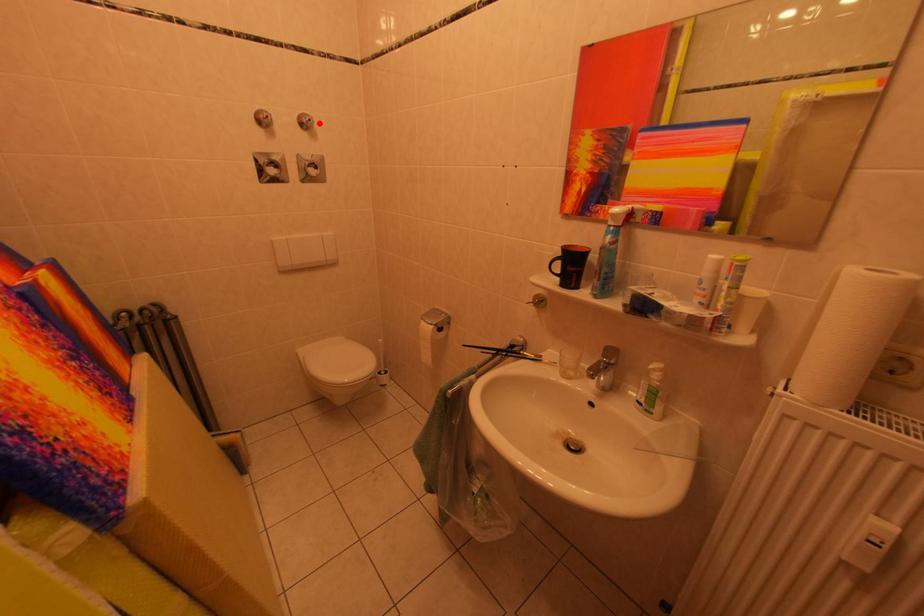
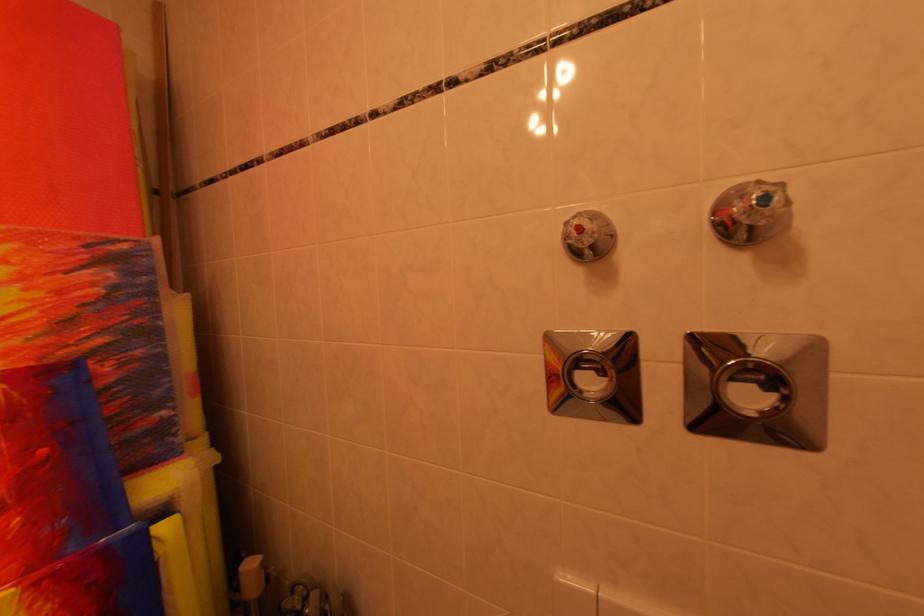
Question: I am providing you with two images of the same scene from different viewpoints. A red point is marked on the first image. Is the red point's position out of view in image 2?

Choices:
 (A) Yes
 (B) No

Answer: (B)